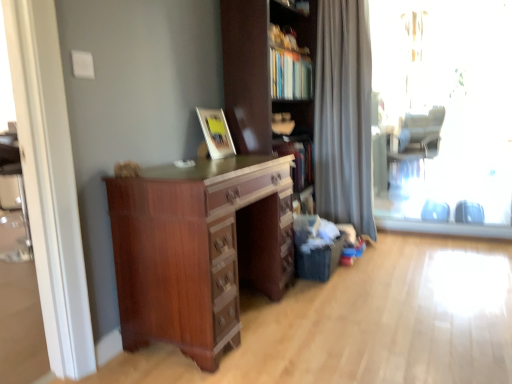
What is the approximate width of transparent glass window at right?

The width of transparent glass window at right is 3.80 inches.

Locate an element on the screen. silky gray curtain at right is located at coordinates click(344, 115).

Measure the distance between point [413,126] and camera.

5.76 meters.

In order to click on mahogany wood chest of drawers at center in this screenshot , I will do `click(199, 249)`.

Is matte brown cupboard at center surrounded by silky gray curtain at right?

No, matte brown cupboard at center is not a part of silky gray curtain at right.

Is silky gray curtain at right oriented towards matte brown cupboard at center?

No.

Considering the positions of objects silky gray curtain at right and matte brown cupboard at center in the image provided, who is more to the right, silky gray curtain at right or matte brown cupboard at center?

silky gray curtain at right is more to the right.

Based on the photo, considering the relative sizes of silky gray curtain at right and matte brown cupboard at center in the image provided, is silky gray curtain at right thinner than matte brown cupboard at center?

Yes.

From the image's perspective, relative to matte brown cupboard at center, is matte wooden picture frame at upper center above or below?

From the image's perspective, matte wooden picture frame at upper center appears below matte brown cupboard at center.

Between matte wooden picture frame at upper center and matte brown cupboard at center, which one appears on the right side from the viewer's perspective?

matte brown cupboard at center.

Which of these two, matte wooden picture frame at upper center or matte brown cupboard at center, is thinner?

Thinner between the two is matte wooden picture frame at upper center.

Is matte wooden picture frame at upper center shorter than matte brown cupboard at center?

Yes.

Measure the distance between matte wooden picture frame at upper center and gray fabric swivel chair at right.

matte wooden picture frame at upper center and gray fabric swivel chair at right are 12.61 feet apart.

Would you say matte wooden picture frame at upper center is inside or outside gray fabric swivel chair at right?

matte wooden picture frame at upper center is outside gray fabric swivel chair at right.

Based on the photo, from the image's perspective, is matte wooden picture frame at upper center below gray fabric swivel chair at right?

Indeed, from the image's perspective, matte wooden picture frame at upper center is shown beneath gray fabric swivel chair at right.

Find the location of a particular element. The image size is (512, 384). swivel chair above the matte wooden picture frame at upper center (from the image's perspective) is located at coordinates (414, 145).

In order to click on cupboard above the mahogany wood chest of drawers at center (from the image's perspective) in this screenshot , I will do click(260, 70).

Looking at this image, which is farther, (220, 271) or (250, 139)?

The point (250, 139) is farther from the camera.

Considering the sizes of mahogany wood chest of drawers at center and matte brown cupboard at center in the image, is mahogany wood chest of drawers at center bigger or smaller than matte brown cupboard at center?

mahogany wood chest of drawers at center is smaller than matte brown cupboard at center.

Considering the sizes of objects mahogany wood chest of drawers at center and matte brown cupboard at center in the image provided, who is thinner, mahogany wood chest of drawers at center or matte brown cupboard at center?

matte brown cupboard at center.

Is transparent glass window at right positioned beyond the bounds of gray fabric swivel chair at right?

Indeed, transparent glass window at right is completely outside gray fabric swivel chair at right.

Is transparent glass window at right in contact with gray fabric swivel chair at right?

No, transparent glass window at right is not with gray fabric swivel chair at right.

Considering the positions of objects transparent glass window at right and gray fabric swivel chair at right in the image provided, who is more to the left, transparent glass window at right or gray fabric swivel chair at right?

From the viewer's perspective, transparent glass window at right appears more on the left side.

Is gray fabric swivel chair at right at the back of transparent glass window at right?

Correct, transparent glass window at right is looking away from gray fabric swivel chair at right.

Can you confirm if gray fabric swivel chair at right is bigger than mahogany wood chest of drawers at center?

Incorrect, gray fabric swivel chair at right is not larger than mahogany wood chest of drawers at center.

Does point (423, 138) appear closer or farther from the camera than point (177, 301)?

Clearly, point (423, 138) is more distant from the camera than point (177, 301).

What's the angular difference between gray fabric swivel chair at right and mahogany wood chest of drawers at center's facing directions?

113 degrees.

Considering the positions of objects gray fabric swivel chair at right and mahogany wood chest of drawers at center in the image provided, who is more to the right, gray fabric swivel chair at right or mahogany wood chest of drawers at center?

gray fabric swivel chair at right is more to the right.

Can you confirm if matte brown cupboard at center is shorter than silky gray curtain at right?

Yes.

From a real-world perspective, is matte brown cupboard at center under silky gray curtain at right?

No, from a real-world perspective, matte brown cupboard at center is not beneath silky gray curtain at right.

How distant is matte brown cupboard at center from silky gray curtain at right?

matte brown cupboard at center and silky gray curtain at right are 33.67 inches apart.

Considering the sizes of objects matte brown cupboard at center and silky gray curtain at right in the image provided, who is bigger, matte brown cupboard at center or silky gray curtain at right?

matte brown cupboard at center.

The width and height of the screenshot is (512, 384). I want to click on cupboard that is on the left side of silky gray curtain at right, so click(x=260, y=70).

Identify the location of picture frame directly beneath the matte brown cupboard at center (from a real-world perspective). This screenshot has width=512, height=384. (216, 133).

From the image, which object appears to be nearer to gray fabric swivel chair at right, matte wooden picture frame at upper center or transparent glass window at right?

Based on the image, transparent glass window at right appears to be nearer to gray fabric swivel chair at right.

Looking at the image, which one is located further to transparent glass window at right, mahogany wood chest of drawers at center or gray fabric swivel chair at right?

Based on the image, mahogany wood chest of drawers at center appears to be further to transparent glass window at right.

Looking at the image, which one is located closer to transparent glass window at right, matte wooden picture frame at upper center or gray fabric swivel chair at right?

Based on the image, gray fabric swivel chair at right appears to be nearer to transparent glass window at right.

From the image, which object appears to be nearer to transparent glass window at right, mahogany wood chest of drawers at center or matte wooden picture frame at upper center?

The object closer to transparent glass window at right is mahogany wood chest of drawers at center.

When comparing their distances from gray fabric swivel chair at right, does mahogany wood chest of drawers at center or silky gray curtain at right seem further?

mahogany wood chest of drawers at center is positioned further to the anchor gray fabric swivel chair at right.

From the image, which object appears to be nearer to silky gray curtain at right, matte wooden picture frame at upper center or gray fabric swivel chair at right?

matte wooden picture frame at upper center is closer to silky gray curtain at right.

Looking at the image, which one is located closer to mahogany wood chest of drawers at center, transparent glass window at right or matte wooden picture frame at upper center?

The object closer to mahogany wood chest of drawers at center is matte wooden picture frame at upper center.

Which object lies nearer to the anchor point mahogany wood chest of drawers at center, matte wooden picture frame at upper center or matte brown cupboard at center?

The object closer to mahogany wood chest of drawers at center is matte wooden picture frame at upper center.

This screenshot has height=384, width=512. I want to click on curtain positioned between transparent glass window at right and gray fabric swivel chair at right from near to far, so click(x=344, y=115).

Find the location of a particular element. The image size is (512, 384). picture frame located between matte brown cupboard at center and gray fabric swivel chair at right in the depth direction is located at coordinates (216, 133).

Where is `picture frame positioned between mahogany wood chest of drawers at center and silky gray curtain at right from near to far`? This screenshot has width=512, height=384. picture frame positioned between mahogany wood chest of drawers at center and silky gray curtain at right from near to far is located at coordinates (216, 133).

Where is `the chest of drawers located between matte wooden picture frame at upper center and transparent glass window at right in the left-right direction`? the chest of drawers located between matte wooden picture frame at upper center and transparent glass window at right in the left-right direction is located at coordinates (199, 249).